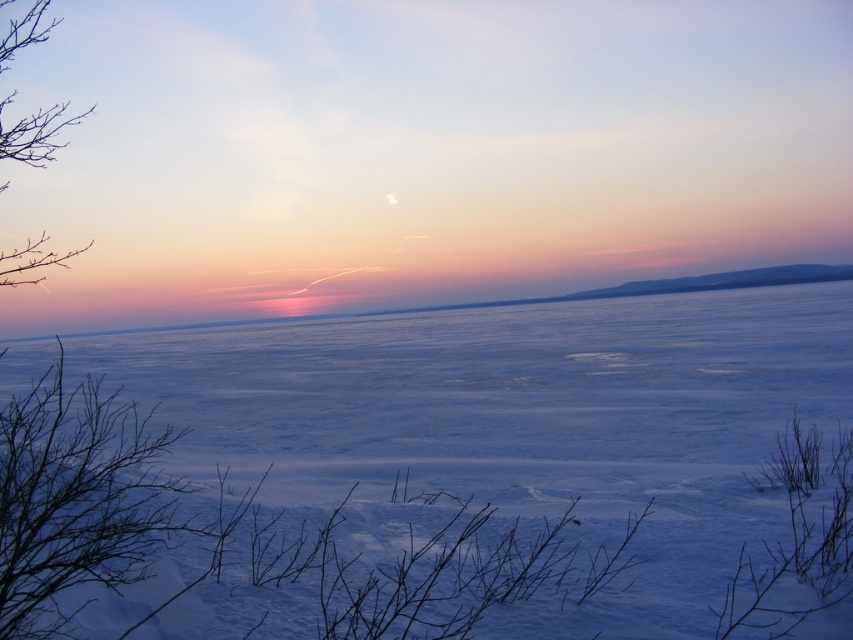
You are an observer standing at the edge of the frozen lake. You notice the white ice at center and the bare branches at left. Which object is closer to the horizon?

The white ice at center is closer to the horizon because it is shorter than the bare branches at left, meaning the branches are closer to the observer and the ice is further away.

You are an ice skater standing near the bare branches at left. You want to glide to the white ice at center. In which direction should you move?

You should move to your right since the white ice at center is to the right of the bare branches at left.